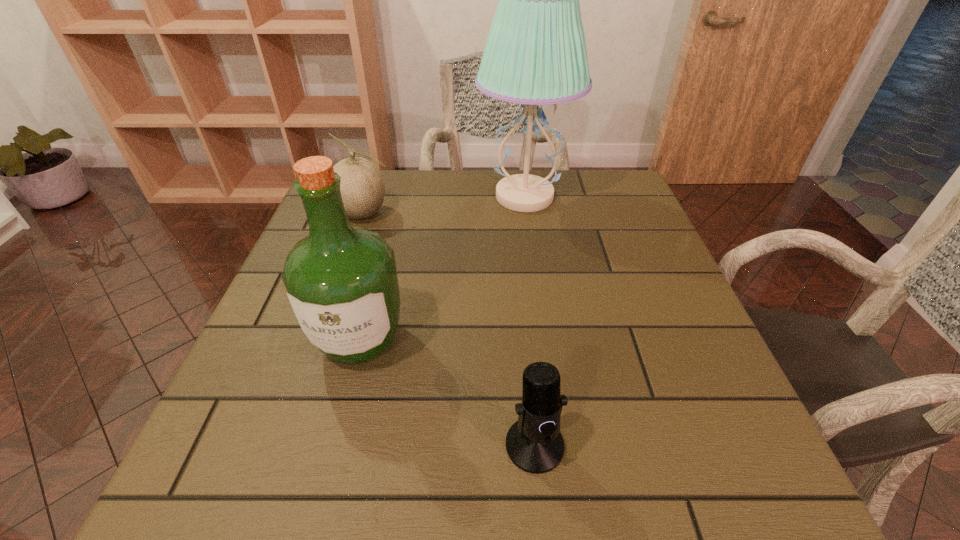
This screenshot has width=960, height=540. I want to click on lamp, so click(x=535, y=54).

The image size is (960, 540). Identify the location of liquor. (341, 280).

Where is `the third farthest object`? The image size is (960, 540). the third farthest object is located at coordinates (341, 280).

This screenshot has width=960, height=540. I want to click on cantaloup, so click(x=362, y=186).

The width and height of the screenshot is (960, 540). Identify the location of microphone. (534, 444).

The width and height of the screenshot is (960, 540). I want to click on vacant space positioned on the left of the lamp, so click(432, 197).

Where is `vacant space located 0.080m on the front-facing side of the third shortest object`? vacant space located 0.080m on the front-facing side of the third shortest object is located at coordinates (338, 422).

Image resolution: width=960 pixels, height=540 pixels. In order to click on vacant area situated on the right of the cantaloup in this screenshot , I will do `click(532, 214)`.

This screenshot has height=540, width=960. I want to click on lamp positioned at the far edge, so click(x=535, y=54).

The image size is (960, 540). I want to click on cantaloup at the far edge, so click(362, 186).